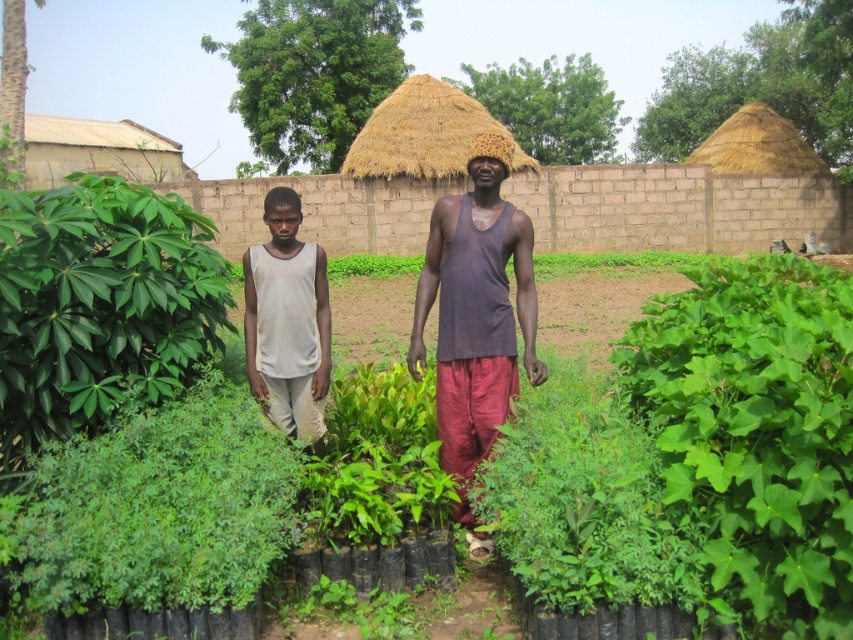
Is green leafy plants at center taller than matte brown tank top at center?

Incorrect, green leafy plants at center's height is not larger of matte brown tank top at center's.

Looking at this image, between green leafy plants at center and matte brown tank top at center, which one is positioned higher?

matte brown tank top at center

Which is in front, point (846, 458) or point (477, 188)?

Point (846, 458) is more forward.

This screenshot has width=853, height=640. In order to click on green leafy plants at center in this screenshot , I will do `click(672, 448)`.

Which is below, green leafy plant at left or gray matte tank top at center?

Positioned lower is gray matte tank top at center.

Does point (219, 310) lie behind point (317, 369)?

Yes, it is.

Who is more distant from viewer, (135, 228) or (325, 268)?

Point (325, 268)

Identify the location of green leafy plant at left. This screenshot has width=853, height=640. (97, 305).

This screenshot has height=640, width=853. Find the location of `green leafy plant at left`. green leafy plant at left is located at coordinates (97, 305).

Is green leafy plant at left shorter than matte brown tank top at center?

Yes, green leafy plant at left is shorter than matte brown tank top at center.

Locate an element on the screen. green leafy plant at left is located at coordinates (97, 305).